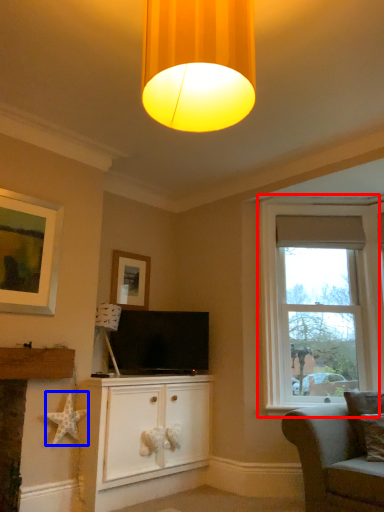
Question: Which object appears farthest to the camera in this image, window (highlighted by a red box) or star (highlighted by a blue box)?

Choices:
 (A) window
 (B) star

Answer: (A)